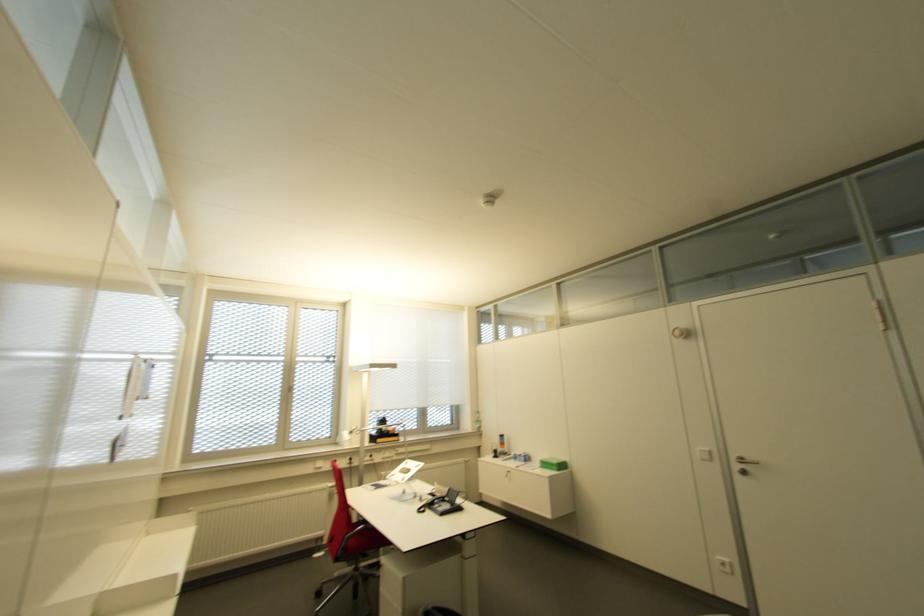
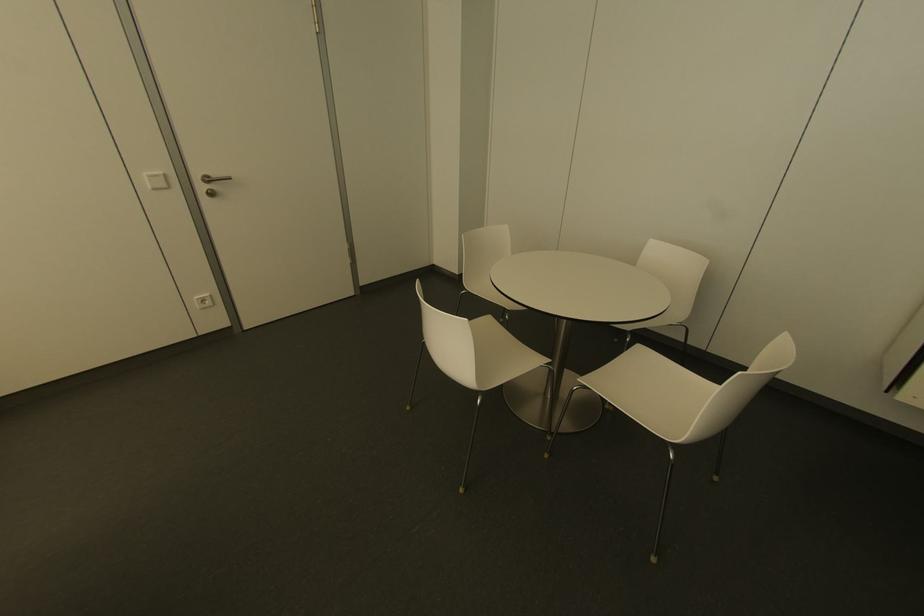
Where in the second image is the point corresponding to point 748,459 from the first image?

(213, 175)